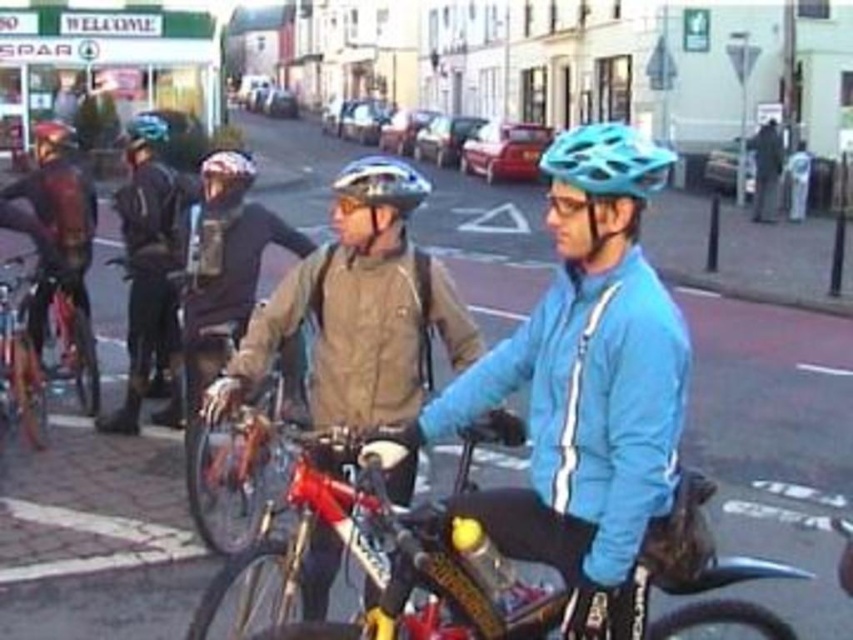
Measure the distance between matte blue jacket at center and shiny metallic bicycle at left.

matte blue jacket at center and shiny metallic bicycle at left are 5.59 meters apart from each other.

Between matte blue jacket at center and shiny metallic bicycle at left, which one is positioned lower?

shiny metallic bicycle at left

Which is in front, point (503, 493) or point (24, 403)?

Positioned in front is point (503, 493).

Where is `matte blue jacket at center`? This screenshot has height=640, width=853. matte blue jacket at center is located at coordinates (589, 392).

Is matte blue jacket at center to the left of matte silver helmet at center from the viewer's perspective?

In fact, matte blue jacket at center is to the right of matte silver helmet at center.

This screenshot has width=853, height=640. What do you see at coordinates (589, 392) in the screenshot?
I see `matte blue jacket at center` at bounding box center [589, 392].

The width and height of the screenshot is (853, 640). Describe the element at coordinates (589, 392) in the screenshot. I see `matte blue jacket at center` at that location.

You are a GUI agent. You are given a task and a screenshot of the screen. Output one action in this format:
    pyautogui.click(x=<x>, y=<y>)
    Task: Click on the matte blue jacket at center
    The image size is (853, 640).
    Given the screenshot: What is the action you would take?
    pyautogui.click(x=589, y=392)

Does point (149, 305) come closer to viewer compared to point (160, 134)?

That is True.

Is matte black jacket at center shorter than matte blue helmet at upper left?

No.

What do you see at coordinates (149, 268) in the screenshot?
I see `matte black jacket at center` at bounding box center [149, 268].

Identify the location of matte black jacket at center. This screenshot has width=853, height=640. (149, 268).